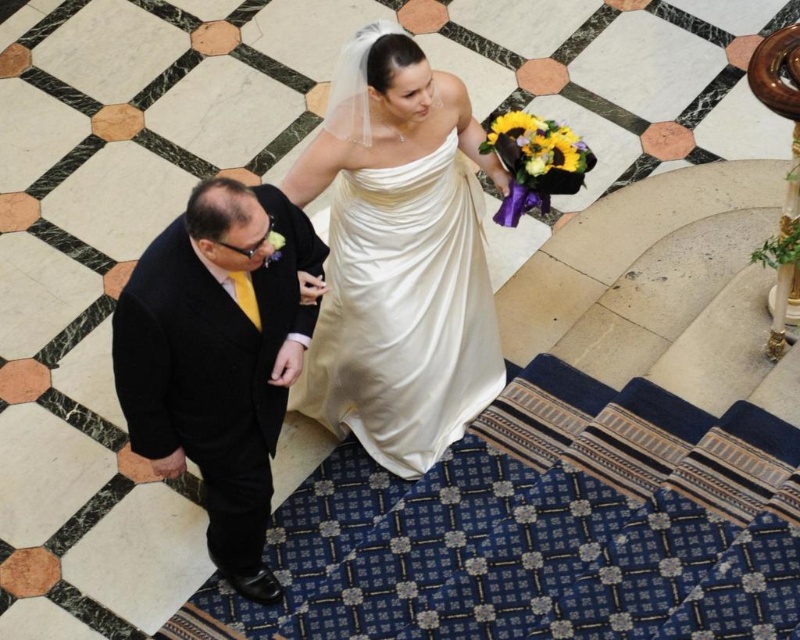
What do you see at coordinates (404, 312) in the screenshot?
I see `ivory satin dress at center` at bounding box center [404, 312].

Which is in front, point (314, 392) or point (521, 209)?

Positioned in front is point (521, 209).

Is point (445, 166) in front of point (504, 164)?

Yes, point (445, 166) is closer to viewer.

The width and height of the screenshot is (800, 640). I want to click on ivory satin dress at center, so click(x=404, y=312).

Between black wool suit at left and yellow fabric bouquet at center, which one appears on the left side from the viewer's perspective?

Positioned to the left is black wool suit at left.

Does black wool suit at left come in front of yellow fabric bouquet at center?

Yes, it is in front of yellow fabric bouquet at center.

The height and width of the screenshot is (640, 800). Identify the location of black wool suit at left. (220, 356).

Which is in front, point (258, 394) or point (428, 179)?

Point (258, 394) is in front.

Between point (200, 356) and point (322, 320), which one is positioned behind?

Point (322, 320)

This screenshot has height=640, width=800. Identify the location of black wool suit at left. (220, 356).